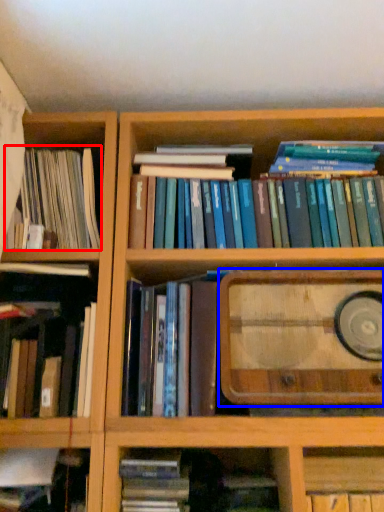
Question: Among these objects, which one is farthest to the camera, book (highlighted by a red box) or book cover (highlighted by a blue box)?

Choices:
 (A) book
 (B) book cover

Answer: (A)